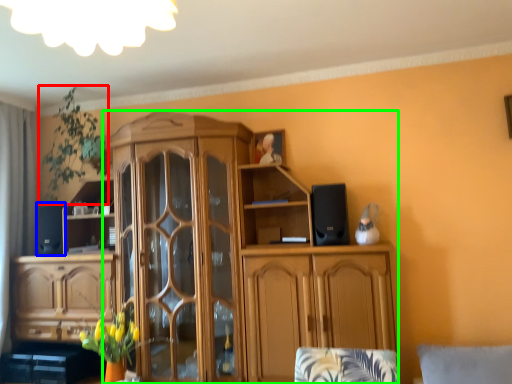
Question: Which object is positioned closest to plant (highlighted by a red box)? Select from speaker (highlighted by a blue box) and cabinetry (highlighted by a green box).

Choices:
 (A) speaker
 (B) cabinetry

Answer: (A)